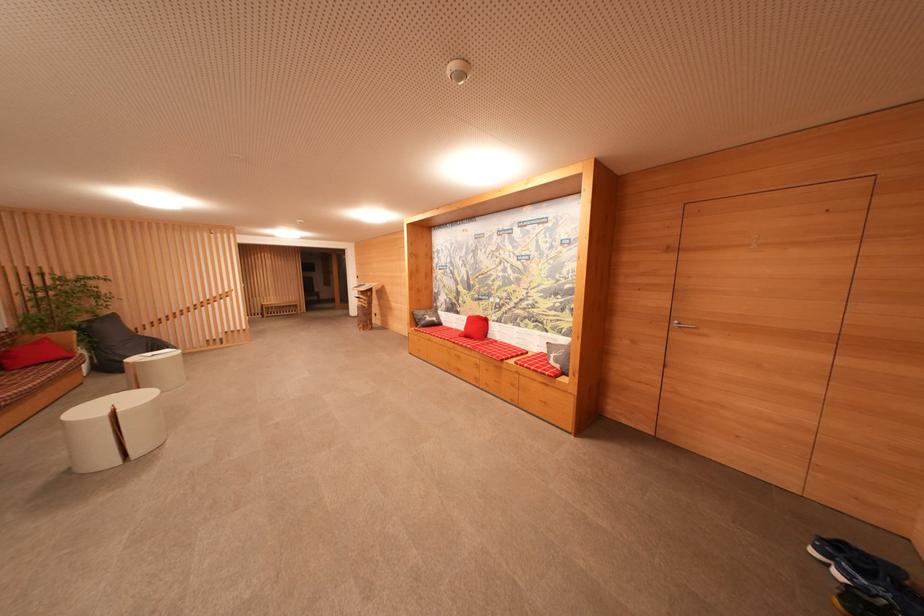
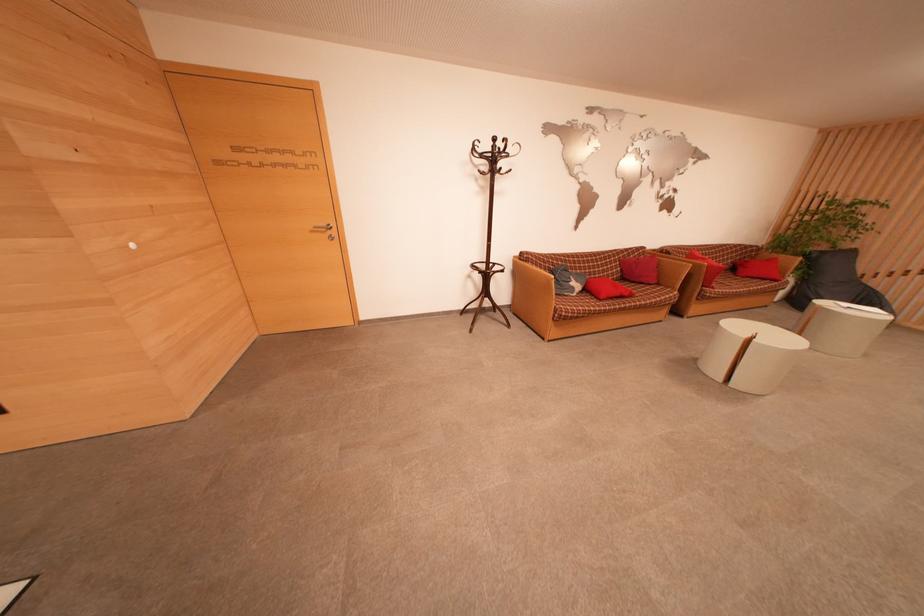
How did the camera likely rotate?

The camera's rotation is toward left-down.